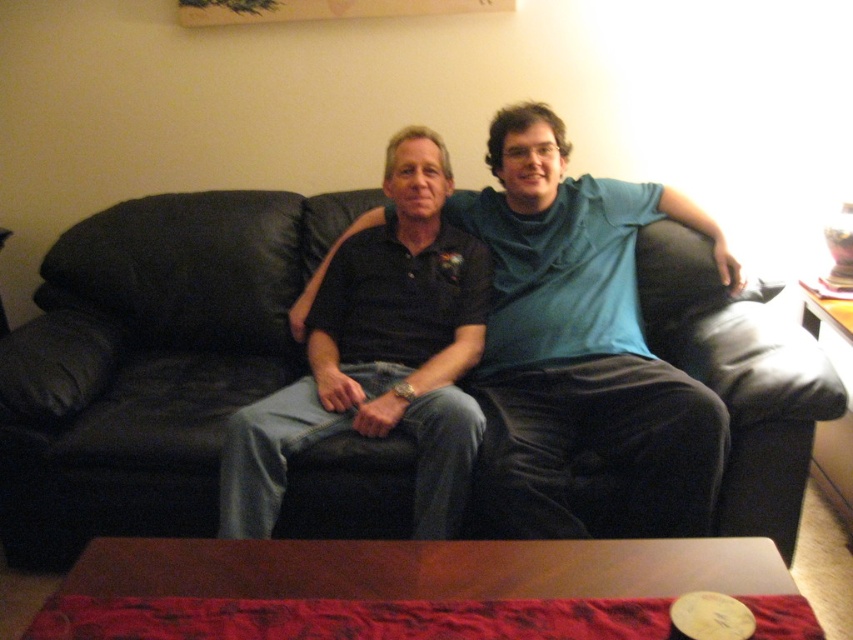
You are a furniture delivery person and need to move the black leather couch at center and the matte black couch at center through a narrow hallway that is 3 feet wide. Based on the scene description, which couch is more likely to fit through the hallway without needing to be disassembled?

The black leather couch at center is thinner than the matte black couch at center, so the black leather couch at center is more likely to fit through the hallway without needing to be disassembled.

You are helping to arrange furniture in a living room. You have a matte black shirt at center and a matte black couch at center. Which object should you place first if you want to ensure there is enough space for both?

You should place the matte black couch at center first since it is larger in size than the matte black shirt at center, ensuring there is enough space for both objects.

You are a guest entering the living room and want to sit on the matte black couch at center. Where should you sit relative to the matte black shirt at center?

The matte black couch at center is to the right of the matte black shirt at center, so you should sit to the right of the matte black shirt at center.